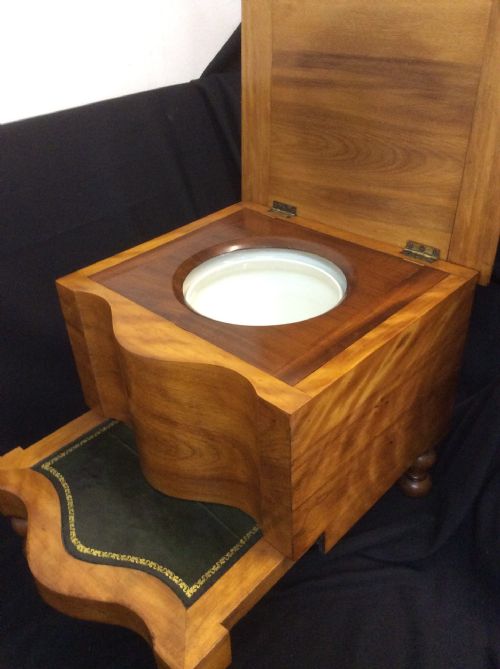
You are a GUI agent. You are given a task and a screenshot of the screen. Output one action in this format:
    pyautogui.click(x=<x>, y=<y>)
    Task: Click on the door of the furniture item
    Image resolution: width=500 pixels, height=669 pixels.
    Given the screenshot: What is the action you would take?
    387,114